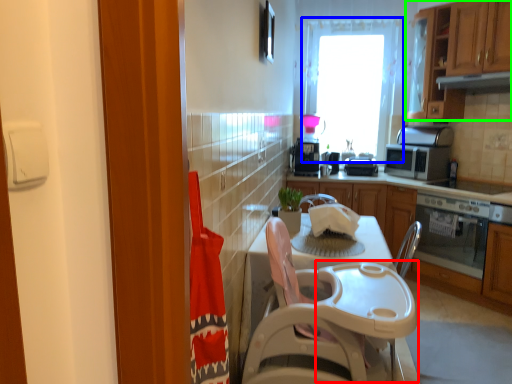
Question: Estimate the real-world distances between objects in this image. Which object is farther from table (highlighted by a red box), window (highlighted by a blue box) or cabinetry (highlighted by a green box)?

Choices:
 (A) window
 (B) cabinetry

Answer: (A)